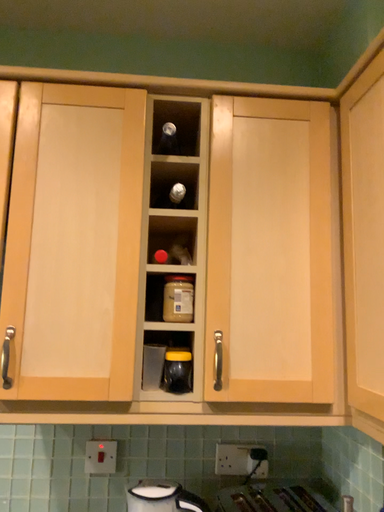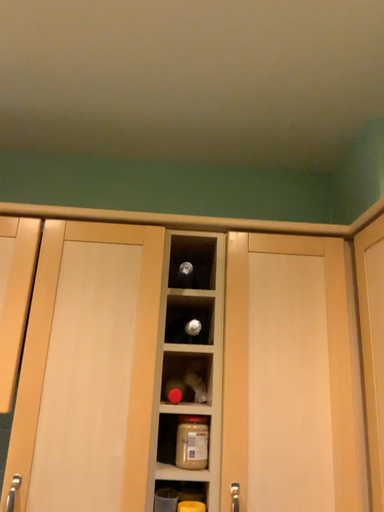
Question: Which way did the camera rotate in the video?

Choices:
 (A) rotated upward
 (B) rotated downward

Answer: (A)